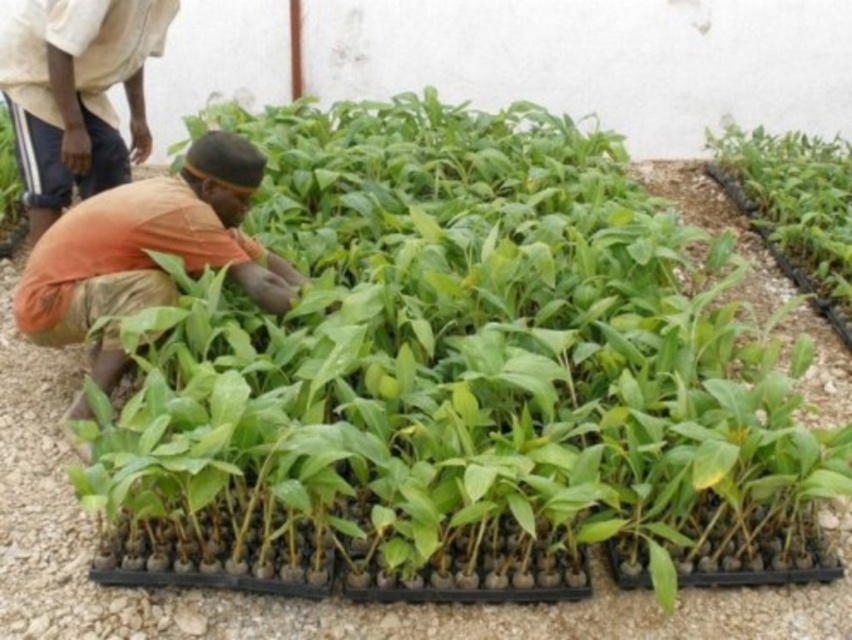
Is green leafy plant at upper right thinner than green leafy plant at center?

No, green leafy plant at upper right is not thinner than green leafy plant at center.

Does green leafy plant at upper right have a larger size compared to green leafy plant at center?

Indeed, green leafy plant at upper right has a larger size compared to green leafy plant at center.

Where is `green leafy plant at upper right`? green leafy plant at upper right is located at coordinates pyautogui.click(x=796, y=198).

Does orange fabric at center have a greater height compared to green leafy plant at upper right?

In fact, orange fabric at center may be shorter than green leafy plant at upper right.

Is the position of orange fabric at center more distant than that of green leafy plant at upper right?

No, it is in front of green leafy plant at upper right.

Is point (72, 221) behind point (843, 289)?

No, (72, 221) is in front of (843, 289).

Where is `orange fabric at center`? This screenshot has height=640, width=852. orange fabric at center is located at coordinates (151, 244).

Based on the photo, does orange fabric shirt at lower left have a larger size compared to green leafy plant at center?

Yes, orange fabric shirt at lower left is bigger than green leafy plant at center.

Can you confirm if orange fabric shirt at lower left is smaller than green leafy plant at center?

Incorrect, orange fabric shirt at lower left is not smaller in size than green leafy plant at center.

Is point (84, 166) behind point (9, 154)?

No, it is in front of (9, 154).

You are a GUI agent. You are given a task and a screenshot of the screen. Output one action in this format:
    pyautogui.click(x=<x>, y=<y>)
    Task: Click on the orange fabric shirt at lower left
    The width and height of the screenshot is (852, 640).
    Given the screenshot: What is the action you would take?
    click(x=76, y=93)